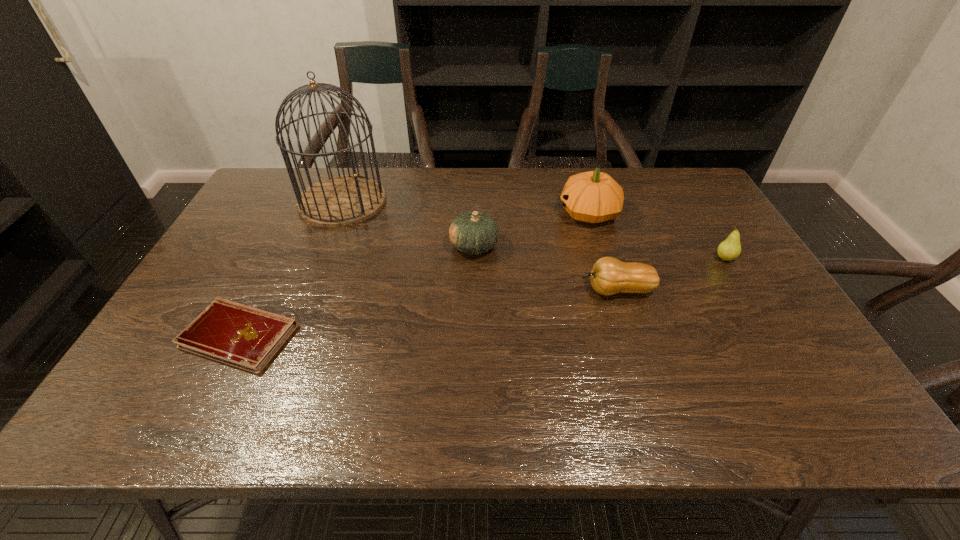
I want to click on free space at the far edge, so click(x=478, y=186).

I want to click on free region at the left edge of the desktop, so click(x=242, y=274).

Identify the location of vacant space at the right edge. The image size is (960, 540). (717, 249).

Locate an element on the screen. Image resolution: width=960 pixels, height=540 pixels. vacant position at the far left corner of the desktop is located at coordinates (267, 195).

Find the location of a particular element. This screenshot has height=540, width=960. free space at the far right corner is located at coordinates (676, 170).

Locate an element on the screen. The width and height of the screenshot is (960, 540). free location at the near right corner of the desktop is located at coordinates (826, 399).

Image resolution: width=960 pixels, height=540 pixels. I want to click on empty space that is in between the tallest gourd and the birdcage, so click(x=466, y=207).

This screenshot has width=960, height=540. What are the coordinates of `free space between the second tallest object and the nearest gourd` in the screenshot? It's located at (603, 252).

Locate an element on the screen. The width and height of the screenshot is (960, 540). free space between the tallest gourd and the birdcage is located at coordinates (466, 207).

What are the coordinates of `vacant area that lies between the tallest gourd and the leftmost gourd` in the screenshot? It's located at (532, 230).